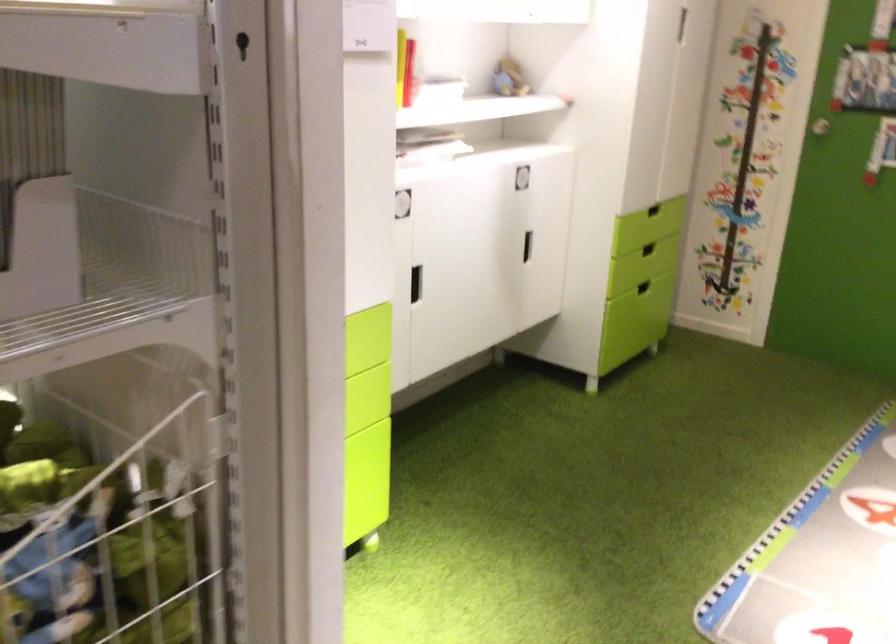
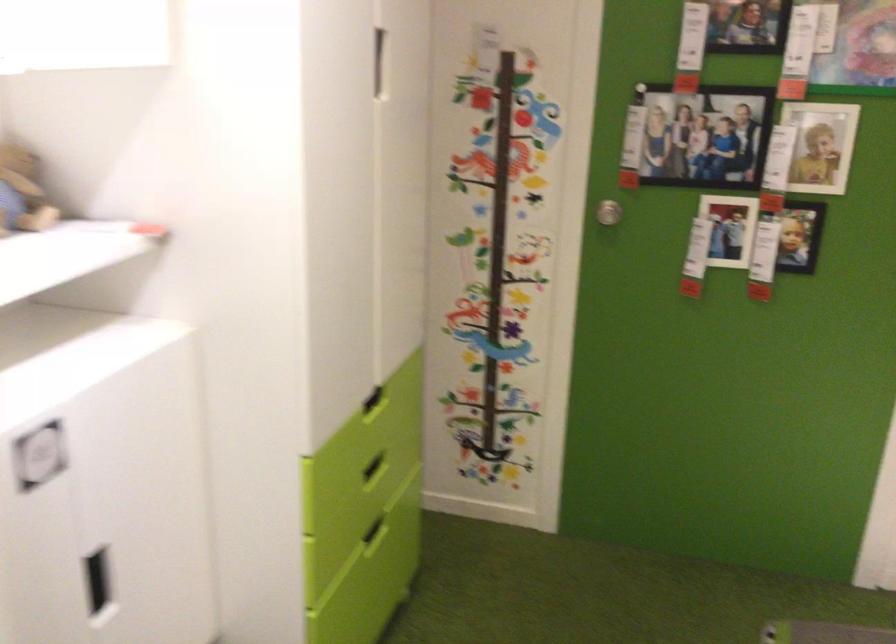
Where in the second image is the point corresponding to (x=651, y=281) from the first image?

(375, 531)